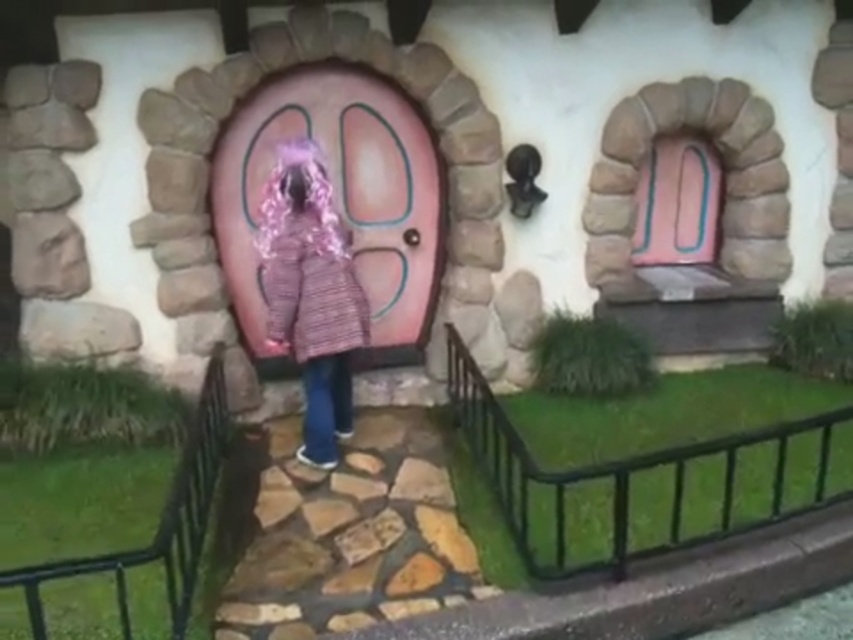
Question: Which of the following is the closest to the observer?

Choices:
 (A) (647, 212)
 (B) (285, 308)

Answer: (B)

Question: Does pink knitted coat at center appear under pink glossy door at upper center?

Choices:
 (A) yes
 (B) no

Answer: (A)

Question: Which point is closer to the camera taking this photo?

Choices:
 (A) (695, 173)
 (B) (270, 202)

Answer: (B)

Question: Which of the following is the farthest from the observer?

Choices:
 (A) pink knitted coat at center
 (B) pink glossy door at upper center

Answer: (B)

Question: Does pink knitted coat at center have a lesser width compared to pink glossy door at upper center?

Choices:
 (A) no
 (B) yes

Answer: (B)

Question: Is pink knitted coat at center below pink glossy door at upper center?

Choices:
 (A) no
 (B) yes

Answer: (B)